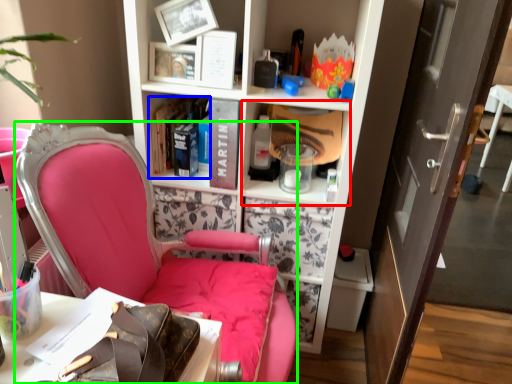
Question: Considering the real-world distances, which object is farthest from cabinet (highlighted by a red box)? book (highlighted by a blue box) or chair (highlighted by a green box)?

Choices:
 (A) book
 (B) chair

Answer: (B)